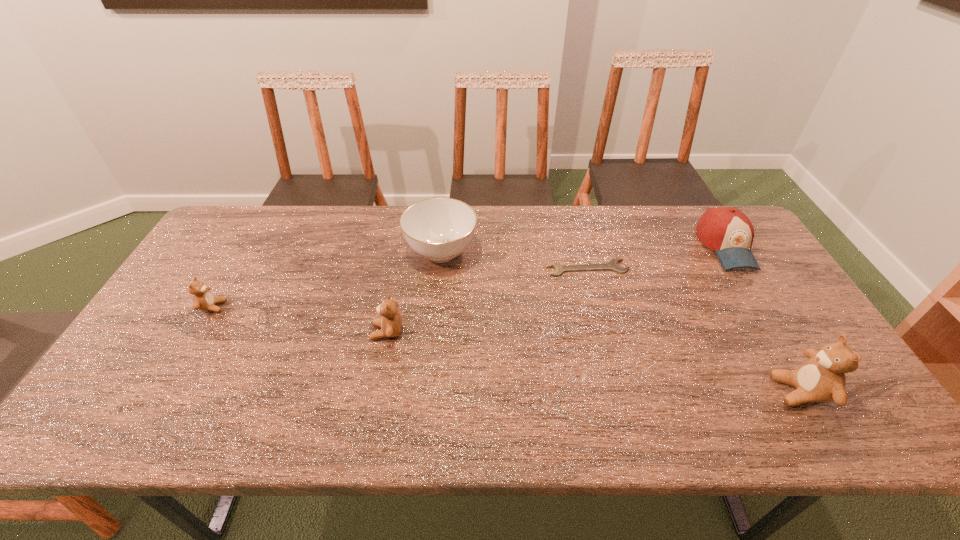
Find the location of a particular element. The width and height of the screenshot is (960, 540). the shortest teddy bear is located at coordinates (203, 299).

Locate an element on the screen. the leftmost object is located at coordinates (203, 299).

Locate an element on the screen. the second teddy bear from right to left is located at coordinates (391, 322).

Where is `the rightmost teddy bear`? Image resolution: width=960 pixels, height=540 pixels. the rightmost teddy bear is located at coordinates (821, 378).

Locate an element on the screen. the tallest object is located at coordinates (821, 378).

In order to click on chinaware in this screenshot , I will do `click(439, 229)`.

Identify the location of baseball cap. This screenshot has height=540, width=960. (726, 230).

The width and height of the screenshot is (960, 540). I want to click on the shortest object, so click(613, 265).

Where is `wrench`? The height and width of the screenshot is (540, 960). wrench is located at coordinates (613, 265).

Find the location of a particular element. blank space located on the front-facing side of the shortest teddy bear is located at coordinates (308, 307).